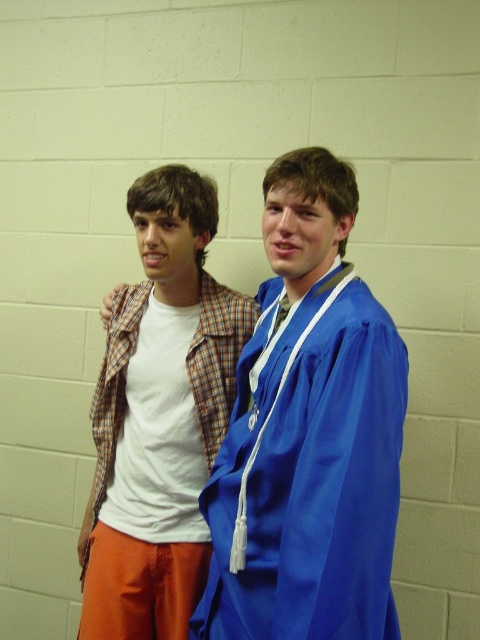
Question: Is satin blue graduation gown at center smaller than white cotton shirt at left?

Choices:
 (A) yes
 (B) no

Answer: (B)

Question: Which point is closer to the camera?

Choices:
 (A) (245, 465)
 (B) (215, 394)

Answer: (A)

Question: Does satin blue graduation gown at center come in front of white cotton shirt at left?

Choices:
 (A) yes
 (B) no

Answer: (A)

Question: Is satin blue graduation gown at center thinner than white cotton shirt at left?

Choices:
 (A) yes
 (B) no

Answer: (A)